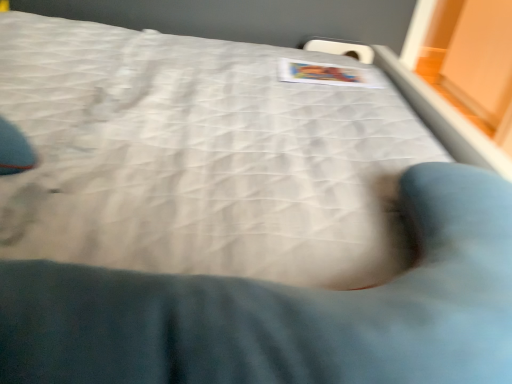
This screenshot has height=384, width=512. Describe the element at coordinates (326, 74) in the screenshot. I see `matte paper paperback book at center` at that location.

The height and width of the screenshot is (384, 512). Identify the location of matte paper paperback book at center. (326, 74).

This screenshot has height=384, width=512. Find the location of `matte paper paperback book at center`. matte paper paperback book at center is located at coordinates (326, 74).